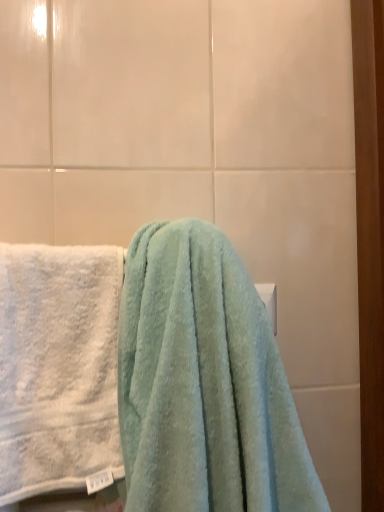
Question: Can you confirm if white fluffy towel at left, which is the first towel from left to right, is smaller than soft blue towel at center, the first towel from the right?

Choices:
 (A) no
 (B) yes

Answer: (B)

Question: Is white fluffy towel at left, which is the first towel from left to right, facing away from soft blue towel at center, the 2th towel viewed from the left?

Choices:
 (A) no
 (B) yes

Answer: (A)

Question: Considering the relative sizes of white fluffy towel at left, which is the first towel from left to right, and soft blue towel at center, the 2th towel viewed from the left, in the image provided, is white fluffy towel at left, which is the first towel from left to right, thinner than soft blue towel at center, the 2th towel viewed from the left,?

Choices:
 (A) yes
 (B) no

Answer: (A)

Question: From the image's perspective, would you say white fluffy towel at left, the second towel when ordered from right to left, is shown under soft blue towel at center, the 2th towel viewed from the left?

Choices:
 (A) no
 (B) yes

Answer: (B)

Question: Can you confirm if white fluffy towel at left, the second towel when ordered from right to left, is bigger than soft blue towel at center, the first towel from the right?

Choices:
 (A) yes
 (B) no

Answer: (B)

Question: From the image's perspective, is white fluffy towel at left, which is the first towel from left to right, on soft blue towel at center, the 2th towel viewed from the left?

Choices:
 (A) yes
 (B) no

Answer: (B)

Question: From a real-world perspective, is soft blue towel at center, the first towel from the right, located higher than white fluffy towel at left, the second towel when ordered from right to left?

Choices:
 (A) no
 (B) yes

Answer: (B)

Question: Considering the relative positions of soft blue towel at center, the first towel from the right, and white fluffy towel at left, which is the first towel from left to right, in the image provided, is soft blue towel at center, the first towel from the right, behind white fluffy towel at left, which is the first towel from left to right,?

Choices:
 (A) yes
 (B) no

Answer: (B)

Question: Can you confirm if soft blue towel at center, the first towel from the right, is positioned to the left of white fluffy towel at left, which is the first towel from left to right?

Choices:
 (A) no
 (B) yes

Answer: (A)

Question: Considering the relative sizes of soft blue towel at center, the first towel from the right, and white fluffy towel at left, which is the first towel from left to right, in the image provided, is soft blue towel at center, the first towel from the right, smaller than white fluffy towel at left, which is the first towel from left to right,?

Choices:
 (A) no
 (B) yes

Answer: (A)

Question: Could you tell me if soft blue towel at center, the first towel from the right, is turned towards white fluffy towel at left, the second towel when ordered from right to left?

Choices:
 (A) yes
 (B) no

Answer: (B)

Question: Would you consider soft blue towel at center, the 2th towel viewed from the left, to be distant from white fluffy towel at left, which is the first towel from left to right?

Choices:
 (A) yes
 (B) no

Answer: (B)

Question: From a real-world perspective, is white fluffy towel at left, which is the first towel from left to right, located higher than white matte towel bar at upper center?

Choices:
 (A) yes
 (B) no

Answer: (B)